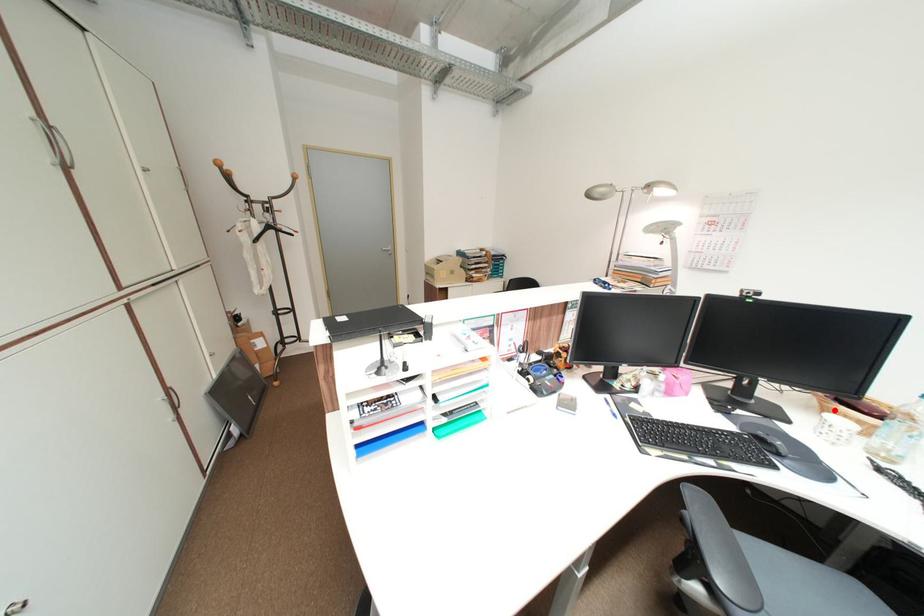
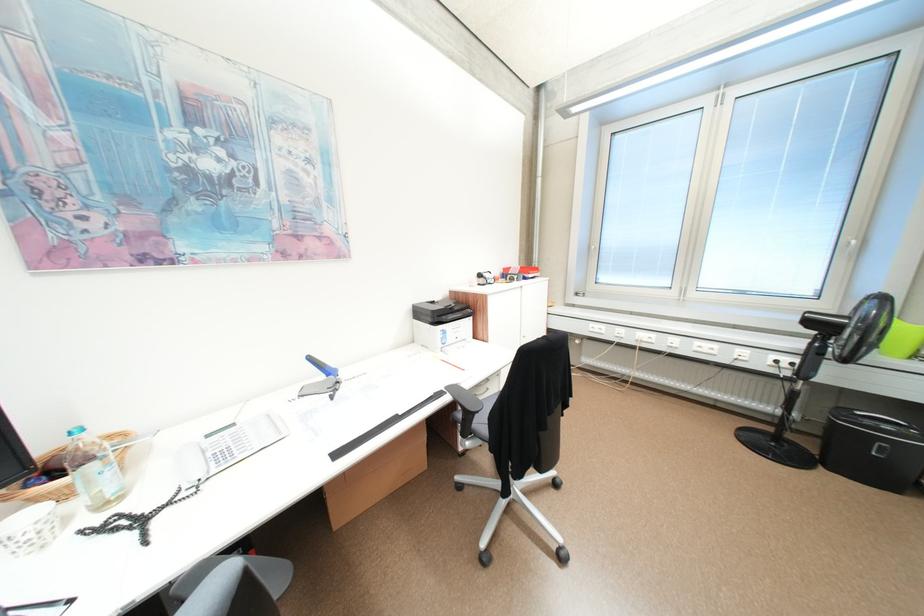
In the second image, find the point that corresponds to the highlighted location in the first image.

(43, 499)